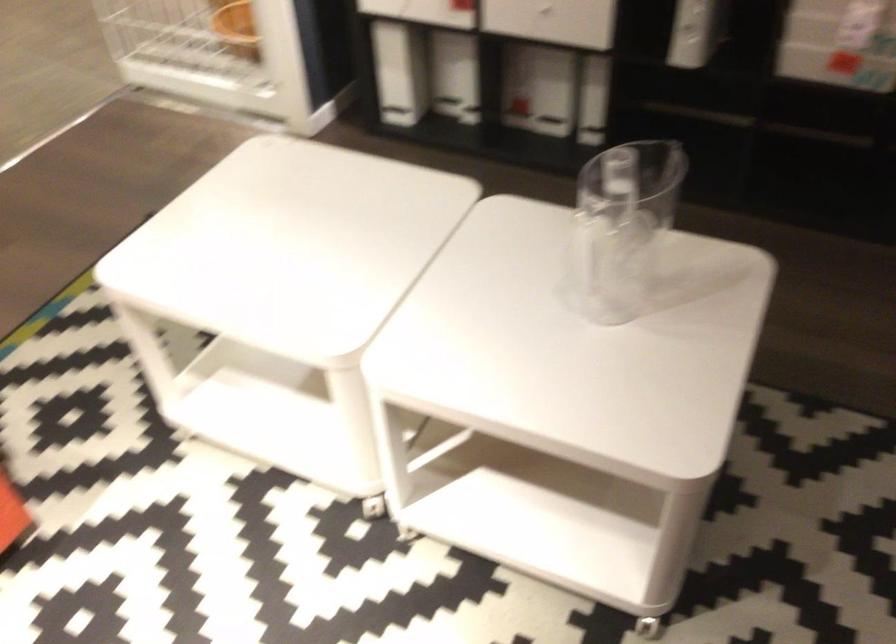
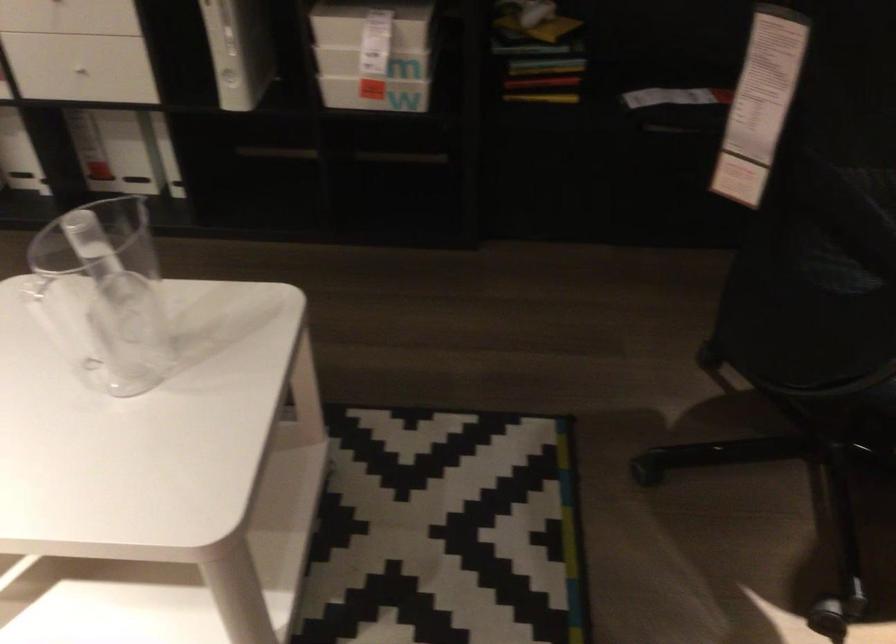
Question: The camera is either moving clockwise (left) or counter-clockwise (right) around the object. The first image is from the beginning of the video and the second image is from the end. Is the camera moving left or right when shooting the video?

Choices:
 (A) Left
 (B) Right

Answer: (A)